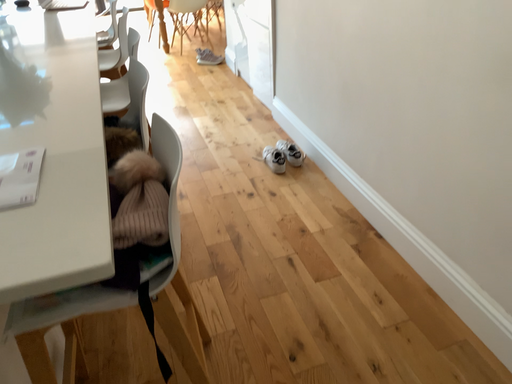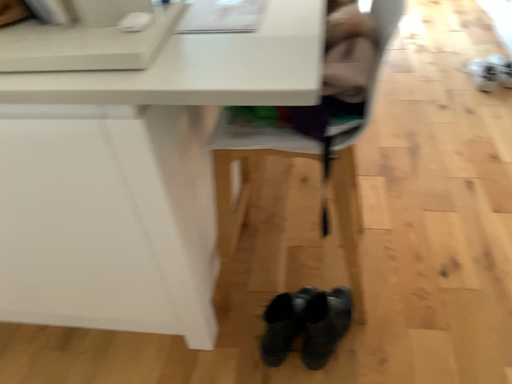
Question: How did the camera likely rotate when shooting the video?

Choices:
 (A) rotated downward
 (B) rotated upward

Answer: (A)